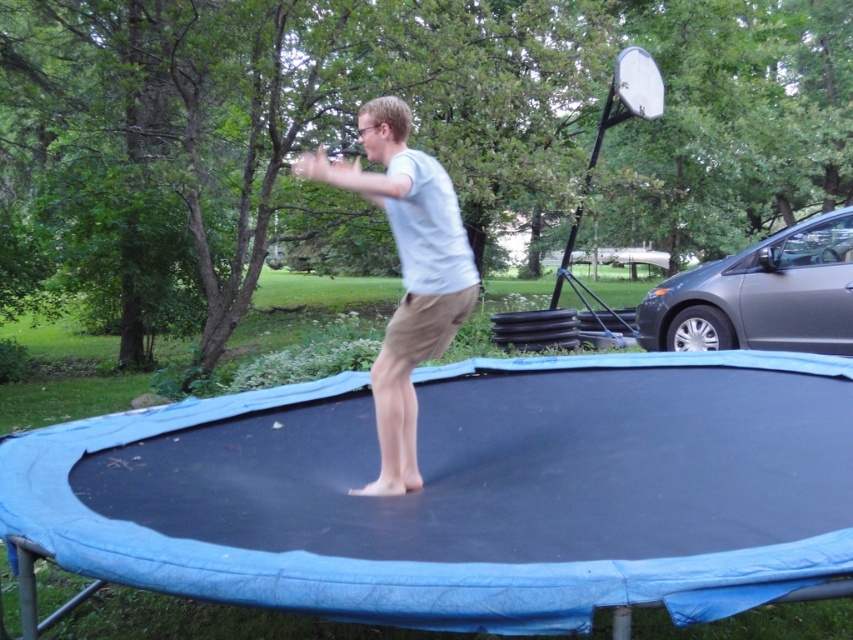
Question: Among these objects, which one is nearest to the camera?

Choices:
 (A) gray metallic car at right
 (B) white matte shirt at center

Answer: (B)

Question: Is white matte shirt at center above gray metallic car at right?

Choices:
 (A) yes
 (B) no

Answer: (B)

Question: Which object is closer to the camera taking this photo?

Choices:
 (A) white matte shirt at center
 (B) gray metallic car at right

Answer: (A)

Question: Can you confirm if white matte shirt at center is thinner than gray metallic car at right?

Choices:
 (A) yes
 (B) no

Answer: (A)

Question: Is white matte shirt at center closer to the viewer compared to gray metallic car at right?

Choices:
 (A) no
 (B) yes

Answer: (B)